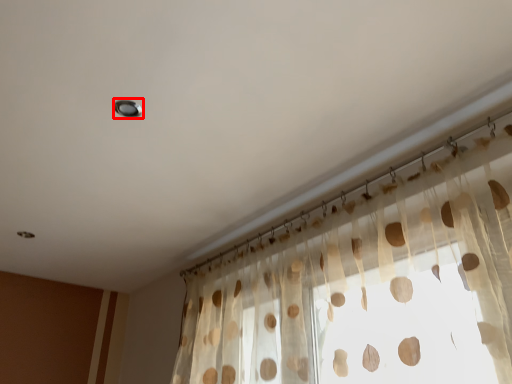
Question: From the image's perspective, where is light (annotated by the red box) located relative to curtain?

Choices:
 (A) below
 (B) above

Answer: (B)